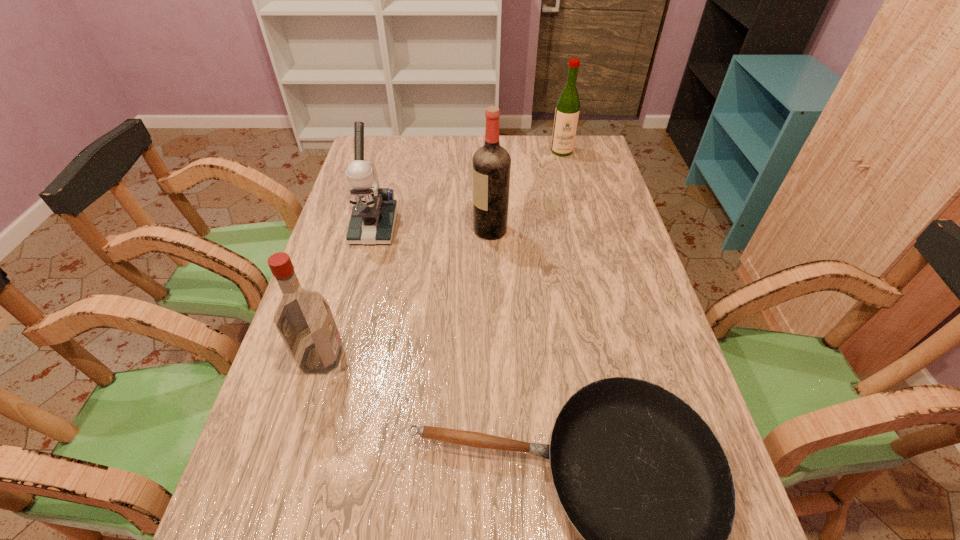
Where is `the second closest liquor to the frying pan`? Image resolution: width=960 pixels, height=540 pixels. the second closest liquor to the frying pan is located at coordinates (491, 164).

The width and height of the screenshot is (960, 540). What are the coordinates of `free space that satisfies the following two spatial constraints: 1. on the label of the farthest object; 2. on the front-facing side of the second nearest liquor` in the screenshot? It's located at point(581,230).

You are a GUI agent. You are given a task and a screenshot of the screen. Output one action in this format:
    pyautogui.click(x=<x>, y=<y>)
    Task: Click on the free spot that satisfies the following two spatial constraints: 1. on the label of the farthest object; 2. on the front-facing side of the second farthest liquor
    The image size is (960, 540).
    Given the screenshot: What is the action you would take?
    pyautogui.click(x=581, y=230)

Locate an element on the screen. The width and height of the screenshot is (960, 540). free point that satisfies the following two spatial constraints: 1. at the eyepiece of the microscope; 2. on the front-facing side of the nearest liquor is located at coordinates (340, 357).

Identify the location of free location that satisfies the following two spatial constraints: 1. at the eyepiece of the microscope; 2. on the front-facing side of the nearest liquor. (340, 357).

Identify the location of free space that satisfies the following two spatial constraints: 1. on the label of the rightmost liquor; 2. on the front-facing side of the second liquor from right to left. This screenshot has width=960, height=540. (581, 230).